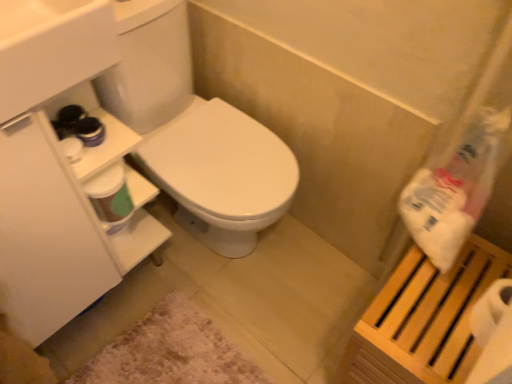
Image resolution: width=512 pixels, height=384 pixels. What are the coordinates of `vacant space behind white fluffy bath mat at lower center` in the screenshot? It's located at click(209, 268).